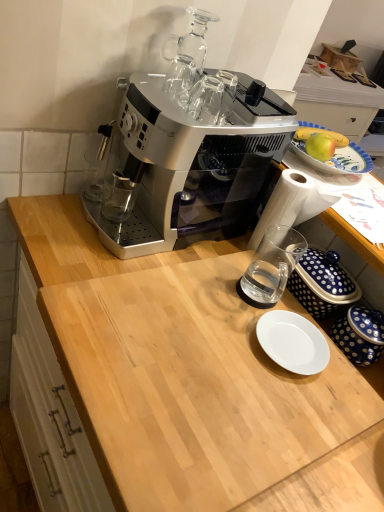
Find the location of a particular element. The height and width of the screenshot is (512, 384). vacant area on top of light wood cutting board at center (from a real-world perspective) is located at coordinates (225, 362).